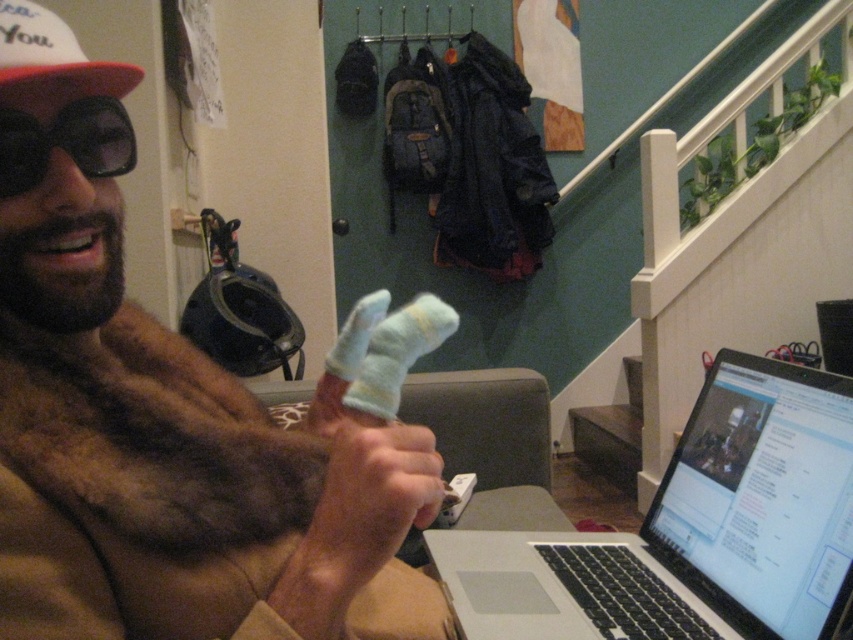
Question: Is silver/black laptop at lower right thinner than knitted wool sock at center?

Choices:
 (A) yes
 (B) no

Answer: (B)

Question: Considering the relative positions of fuzzy fur at center and knitted wool sock at center in the image provided, where is fuzzy fur at center located with respect to knitted wool sock at center?

Choices:
 (A) above
 (B) below

Answer: (B)

Question: Estimate the real-world distances between objects in this image. Which object is farther from the white fuzzy socks at center?

Choices:
 (A) silver/black laptop at lower right
 (B) knitted wool sock at center
 (C) black matte goggles at upper left
 (D) fuzzy fur at center

Answer: (A)

Question: Which point appears farthest from the camera in this image?

Choices:
 (A) (438, 472)
 (B) (155, 564)
 (C) (694, 429)

Answer: (C)

Question: Does white fuzzy socks at center have a smaller size compared to black matte goggles at upper left?

Choices:
 (A) yes
 (B) no

Answer: (B)

Question: Which of these objects is positioned farthest from the white fuzzy socks at center?

Choices:
 (A) knitted wool sock at center
 (B) silver/black laptop at lower right
 (C) black matte goggles at upper left

Answer: (B)